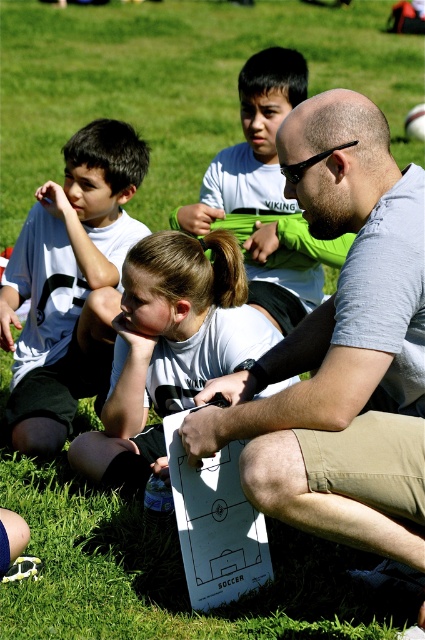
Question: Can you confirm if white matte shirt at upper left is smaller than white matte paper at center?

Choices:
 (A) yes
 (B) no

Answer: (B)

Question: Which point is closer to the camera taking this photo?

Choices:
 (A) (99, 275)
 (B) (235, 328)

Answer: (B)

Question: Can you confirm if white matte shirt at upper left is wider than white matte paper at center?

Choices:
 (A) no
 (B) yes

Answer: (A)

Question: Is white matte shirt at upper left below white matte paper at center?

Choices:
 (A) no
 (B) yes

Answer: (A)

Question: Which point appears closest to the camera in this image?

Choices:
 (A) (260, 324)
 (B) (39, 298)

Answer: (A)